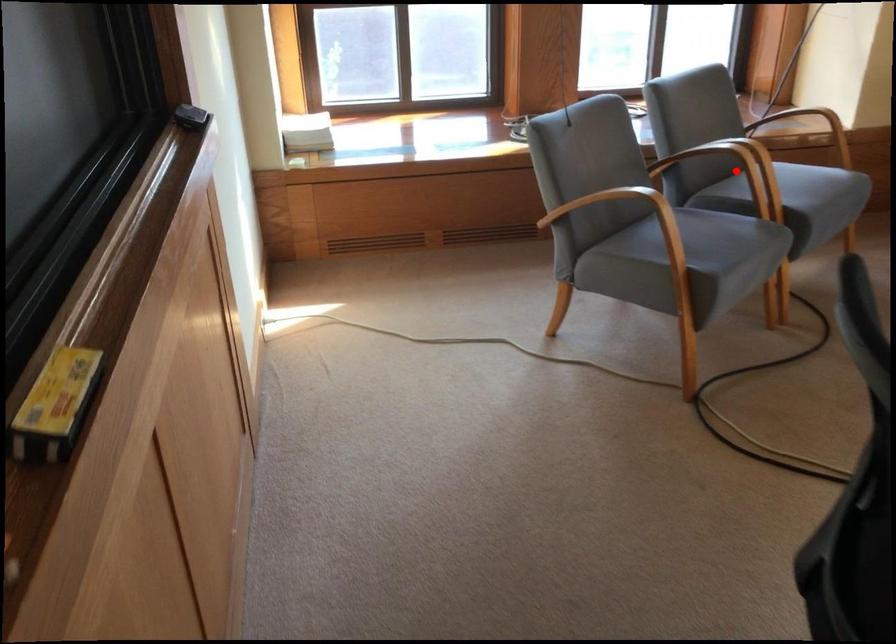
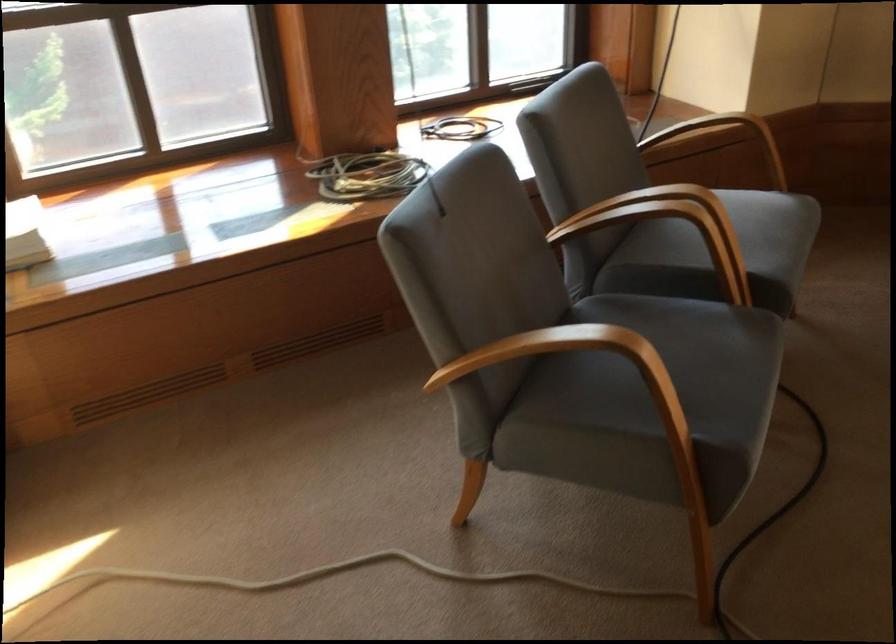
Question: I am providing you with two images of the same scene from different viewpoints. A red point is shown in image1. For the corresponding object point in image2, is it positioned nearer or farther from the camera?

Choices:
 (A) Nearer
 (B) Farther

Answer: (A)